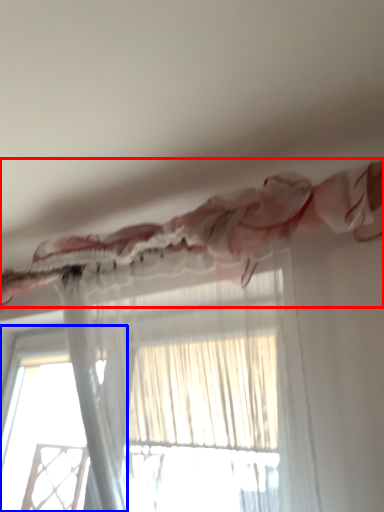
Question: Which of the following is the farthest to the observer, curtain (highlighted by a red box) or window (highlighted by a blue box)?

Choices:
 (A) curtain
 (B) window

Answer: (B)